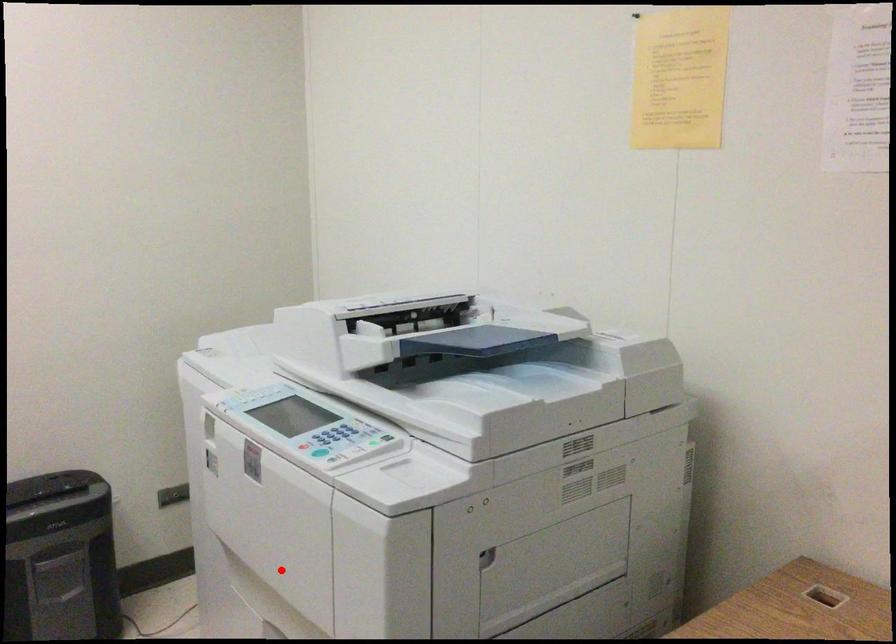
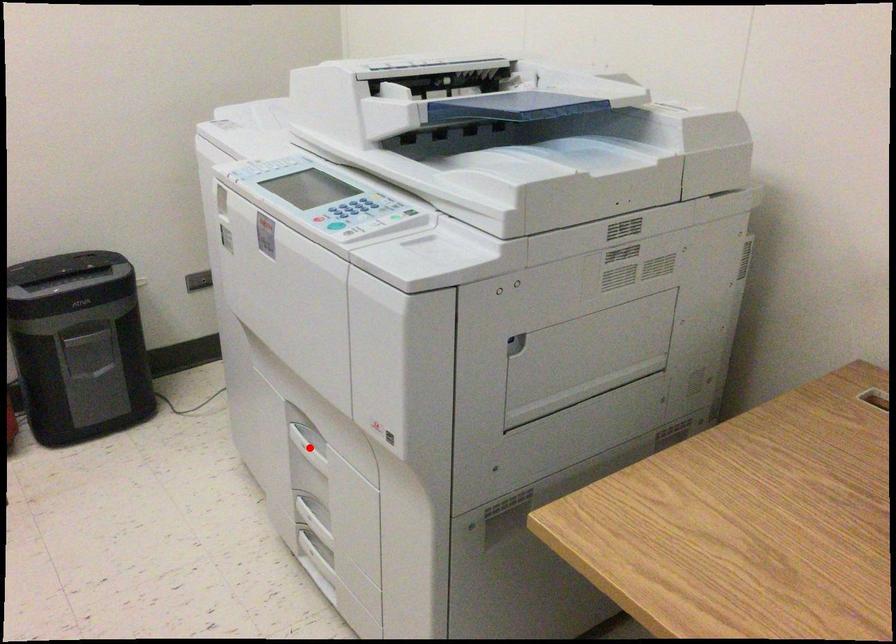
I am providing you with two images of the same scene from different viewpoints. A red point is marked on the first image and another point is marked on the second image. Does the point marked in image1 correspond to the same location as the one in image2?

No